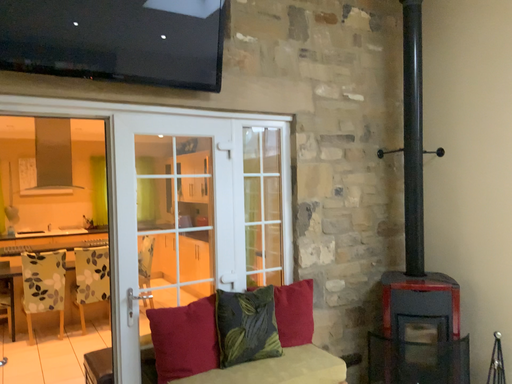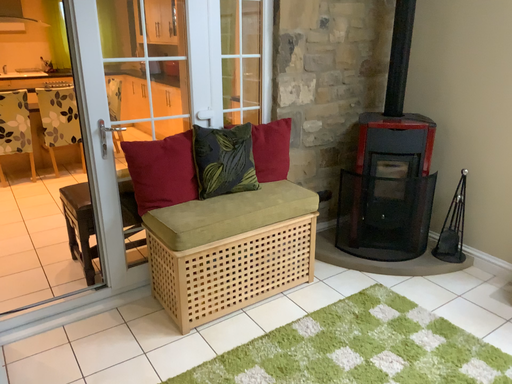
Question: How did the camera likely rotate when shooting the video?

Choices:
 (A) rotated upward
 (B) rotated downward

Answer: (B)